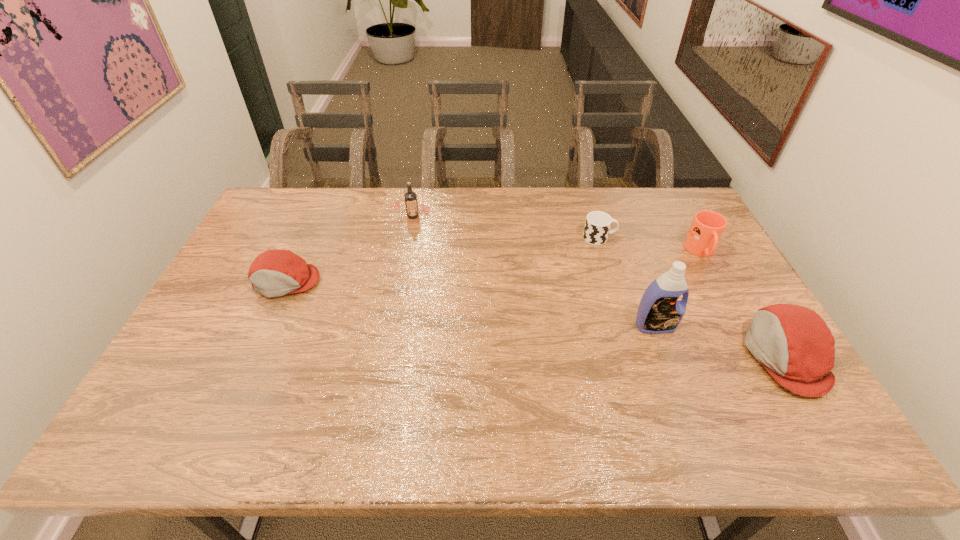
Where is `free area in between the right cap and the cup`? free area in between the right cap and the cup is located at coordinates (692, 297).

The height and width of the screenshot is (540, 960). In order to click on free space between the left cap and the fifth object from right to left in this screenshot , I will do `click(349, 248)`.

This screenshot has width=960, height=540. Find the location of `free spot between the taller cap and the fifth object from right to left`. free spot between the taller cap and the fifth object from right to left is located at coordinates (599, 286).

At what (x,y) coordinates should I click in order to perform the action: click on empty space between the tallest object and the farthest object. Please return your answer as a coordinate pair (x, y). This screenshot has width=960, height=540. Looking at the image, I should click on (534, 271).

You are a GUI agent. You are given a task and a screenshot of the screen. Output one action in this format:
    pyautogui.click(x=<x>, y=<y>)
    Task: Click on the vacant space in between the shorter cap and the detergent
    
    Given the screenshot: What is the action you would take?
    click(x=470, y=303)

Locate an element on the screen. Image resolution: width=960 pixels, height=540 pixels. free space between the cup and the mug is located at coordinates (650, 245).

Where is `free point between the nearer cap and the leftmost object`? The image size is (960, 540). free point between the nearer cap and the leftmost object is located at coordinates [x=536, y=319].

Choose which object is the fourth nearest neighbor to the nearer cap. Please provide its 2D coordinates. Your answer should be formatted as a tuple, i.e. [(x, y)], where the tuple contains the x and y coordinates of a point satisfying the conditions above.

[(410, 197)]

The image size is (960, 540). In order to click on object that is the fifth closest to the nearer cap in this screenshot , I will do `click(276, 272)`.

The width and height of the screenshot is (960, 540). Find the location of `vacant region that satisfies the following two spatial constraints: 1. on the side of the cup with the handle; 2. on the back side of the tallest object`. vacant region that satisfies the following two spatial constraints: 1. on the side of the cup with the handle; 2. on the back side of the tallest object is located at coordinates (626, 326).